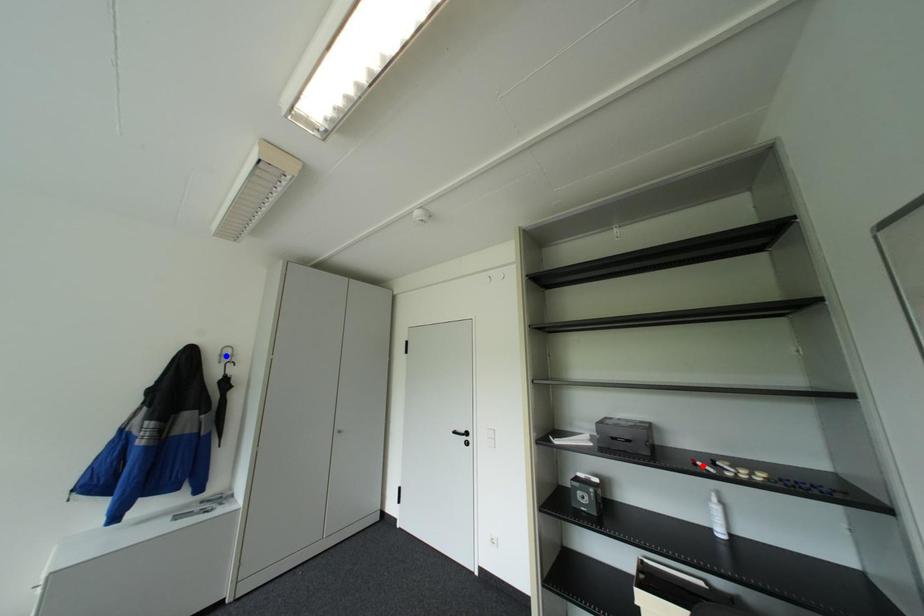
Question: Two points are marked on the image. Which point is closer to the camera?

Choices:
 (A) Blue point is closer.
 (B) Red point is closer.

Answer: (B)